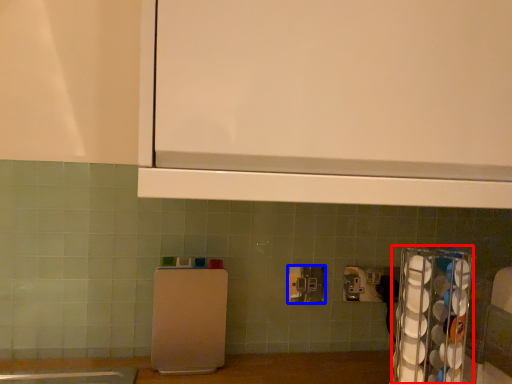
Question: Which of the following is the closest to the observer, appliance (highlighted by a red box) or power plugs and sockets (highlighted by a blue box)?

Choices:
 (A) appliance
 (B) power plugs and sockets

Answer: (A)